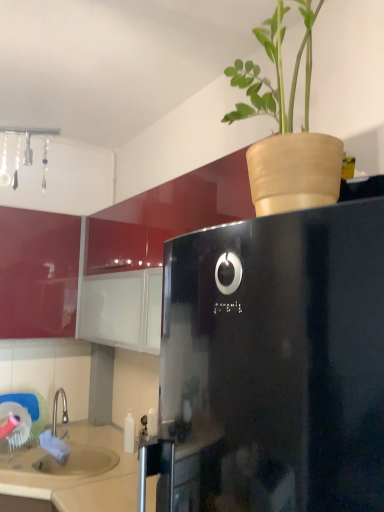
Question: Is glossy red cabinet at left facing away from beige matte sink at lower left?

Choices:
 (A) no
 (B) yes

Answer: (A)

Question: Is glossy red cabinet at left positioned far away from beige matte sink at lower left?

Choices:
 (A) yes
 (B) no

Answer: (B)

Question: Considering the relative positions of glossy red cabinet at left and beige matte sink at lower left in the image provided, is glossy red cabinet at left to the right of beige matte sink at lower left from the viewer's perspective?

Choices:
 (A) no
 (B) yes

Answer: (A)

Question: Is glossy red cabinet at left facing towards beige matte sink at lower left?

Choices:
 (A) yes
 (B) no

Answer: (B)

Question: Can you confirm if glossy red cabinet at left is bigger than beige matte sink at lower left?

Choices:
 (A) yes
 (B) no

Answer: (A)

Question: From a real-world perspective, is glossy red cabinet at left beneath beige matte sink at lower left?

Choices:
 (A) yes
 (B) no

Answer: (B)

Question: Can you confirm if beige matte sink at lower left is shorter than glossy red cabinet at left?

Choices:
 (A) no
 (B) yes

Answer: (B)

Question: Is glossy red cabinet at left inside beige matte sink at lower left?

Choices:
 (A) no
 (B) yes

Answer: (A)

Question: From a real-world perspective, is beige matte sink at lower left below glossy red cabinet at left?

Choices:
 (A) no
 (B) yes

Answer: (B)

Question: Is beige matte sink at lower left thinner than glossy red cabinet at left?

Choices:
 (A) no
 (B) yes

Answer: (A)

Question: Is there a large distance between beige matte sink at lower left and glossy red cabinet at left?

Choices:
 (A) no
 (B) yes

Answer: (A)

Question: Does beige matte sink at lower left appear on the left side of glossy red cabinet at left?

Choices:
 (A) no
 (B) yes

Answer: (A)

Question: Considering the positions of beige matte sink at lower left and glossy red cabinet at left in the image, is beige matte sink at lower left taller or shorter than glossy red cabinet at left?

Choices:
 (A) tall
 (B) short

Answer: (B)